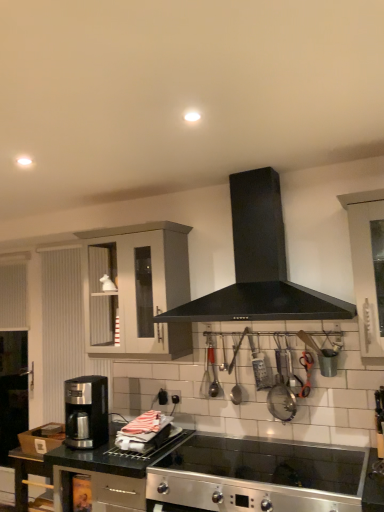
Question: From the image's perspective, is satin black coffee maker at lower left on matte gray cabinet at upper left?

Choices:
 (A) no
 (B) yes

Answer: (A)

Question: Is satin black coffee maker at lower left aimed at matte gray cabinet at upper left?

Choices:
 (A) yes
 (B) no

Answer: (B)

Question: Can matte gray cabinet at upper left be found inside satin black coffee maker at lower left?

Choices:
 (A) no
 (B) yes

Answer: (A)

Question: Can you confirm if satin black coffee maker at lower left is taller than matte gray cabinet at upper left?

Choices:
 (A) yes
 (B) no

Answer: (B)

Question: Is satin black coffee maker at lower left oriented away from matte gray cabinet at upper left?

Choices:
 (A) no
 (B) yes

Answer: (A)

Question: Based on their sizes in the image, would you say satin black coffee maker at lower left is bigger or smaller than stainless steel cooktop at lower center, which is counted as the 1th countertop, starting from the right?

Choices:
 (A) small
 (B) big

Answer: (A)

Question: Is satin black coffee maker at lower left in front of or behind stainless steel cooktop at lower center, which is counted as the 1th countertop, starting from the right, in the image?

Choices:
 (A) front
 (B) behind

Answer: (B)

Question: From their relative heights in the image, would you say satin black coffee maker at lower left is taller or shorter than stainless steel cooktop at lower center, the 2th countertop from the left?

Choices:
 (A) short
 (B) tall

Answer: (B)

Question: Looking at their shapes, would you say satin black coffee maker at lower left is wider or thinner than stainless steel cooktop at lower center, which is counted as the 1th countertop, starting from the right?

Choices:
 (A) thin
 (B) wide

Answer: (A)

Question: In the image, is matte gray cabinet at upper left on the left side or the right side of black matte range hood at center?

Choices:
 (A) left
 (B) right

Answer: (A)

Question: Is matte gray cabinet at upper left situated inside black matte range hood at center or outside?

Choices:
 (A) outside
 (B) inside

Answer: (A)

Question: Is matte gray cabinet at upper left wider or thinner than black matte range hood at center?

Choices:
 (A) thin
 (B) wide

Answer: (A)

Question: Does point (104, 352) appear closer or farther from the camera than point (279, 225)?

Choices:
 (A) farther
 (B) closer

Answer: (A)

Question: Is black matte range hood at center inside or outside of matte gray cabinet at upper left?

Choices:
 (A) inside
 (B) outside

Answer: (B)

Question: Looking at the image, does black matte range hood at center seem bigger or smaller compared to matte gray cabinet at upper left?

Choices:
 (A) small
 (B) big

Answer: (B)